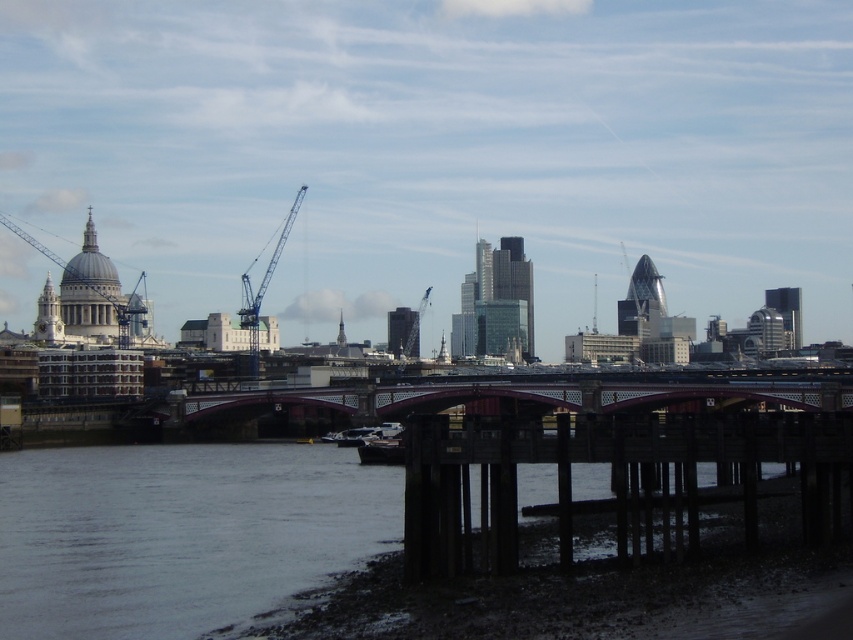
Does blue metallic crane at center lie behind dark gray metallic boat at center?

That is True.

Is blue metallic crane at center above dark gray metallic boat at center?

Yes.

The height and width of the screenshot is (640, 853). What do you see at coordinates (262, 289) in the screenshot? I see `blue metallic crane at center` at bounding box center [262, 289].

What are the coordinates of `blue metallic crane at center` in the screenshot? It's located at (262, 289).

What do you see at coordinates (521, 397) in the screenshot? I see `metallic red bridge at center` at bounding box center [521, 397].

Locate an element on the screen. Image resolution: width=853 pixels, height=640 pixels. metallic red bridge at center is located at coordinates (521, 397).

Measure the distance between metallic red bridge at center and camera.

The distance of metallic red bridge at center from camera is 250.01 meters.

Identify the location of metallic red bridge at center. (521, 397).

Is the position of blue metallic crane at center more distant than that of metallic gray boat at center?

Yes.

The image size is (853, 640). What do you see at coordinates (262, 289) in the screenshot? I see `blue metallic crane at center` at bounding box center [262, 289].

Is point (251, 330) less distant than point (364, 444)?

No, (251, 330) is further to viewer.

Find the location of a particular element. This screenshot has height=640, width=853. blue metallic crane at center is located at coordinates (262, 289).